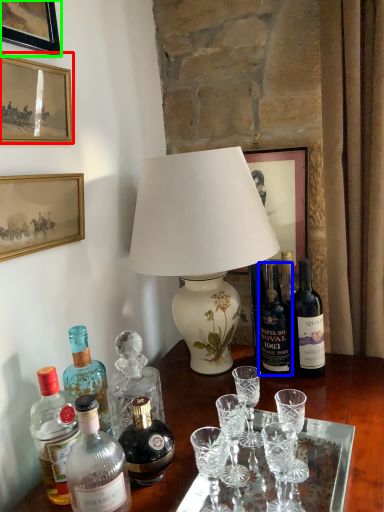
Question: Based on their relative distances, which object is nearer to picture frame (highlighted by a red box)? Choose from bottle (highlighted by a blue box) and picture frame (highlighted by a green box).

Choices:
 (A) bottle
 (B) picture frame

Answer: (B)